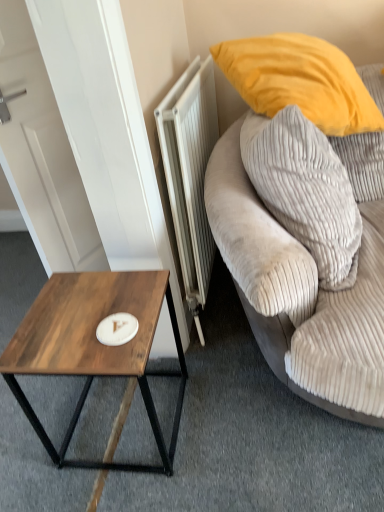
Where is `blank space situated above wooden coffee table at lower left (from a real-world perspective)`? The image size is (384, 512). blank space situated above wooden coffee table at lower left (from a real-world perspective) is located at coordinates (84, 315).